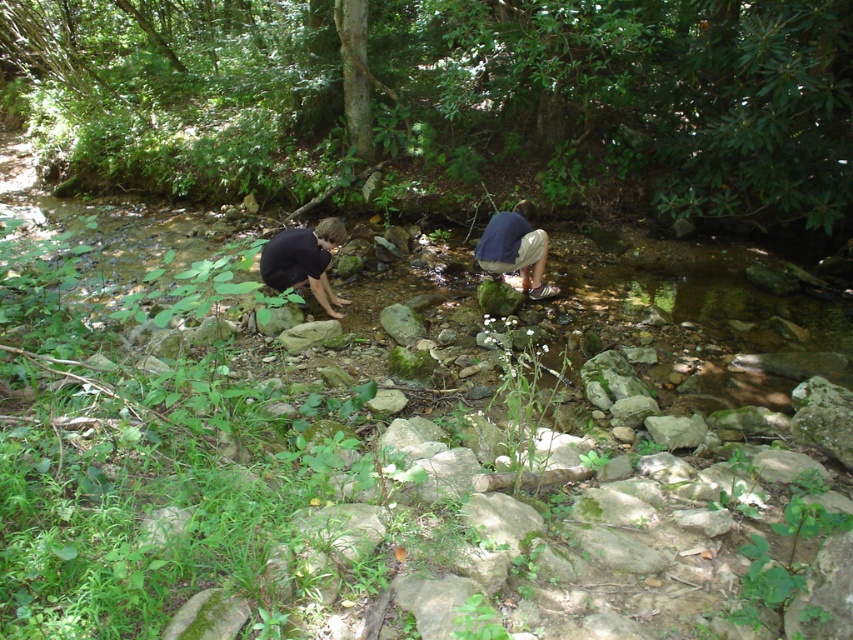
Between point (206, 84) and point (527, 237), which one is positioned behind?

The point (206, 84) is behind.

Can you confirm if green leafy forest at center is smaller than dark blue fabric at center?

No.

This screenshot has height=640, width=853. What are the coordinates of `green leafy forest at center` in the screenshot? It's located at (448, 100).

Where is `green leafy forest at center`? Image resolution: width=853 pixels, height=640 pixels. green leafy forest at center is located at coordinates (448, 100).

Measure the distance between green leafy forest at center and camera.

A distance of 6.24 meters exists between green leafy forest at center and camera.

Is point (142, 100) positioned before point (340, 300)?

No, it is not.

You are a GUI agent. You are given a task and a screenshot of the screen. Output one action in this format:
    pyautogui.click(x=<x>, y=<y>)
    Task: Click on the green leafy forest at center
    
    Given the screenshot: What is the action you would take?
    pyautogui.click(x=448, y=100)

Can you confirm if black matte shirt at center is smaller than dark blue fabric at center?

Yes, black matte shirt at center is smaller than dark blue fabric at center.

Is point (282, 289) closer to camera compared to point (476, 259)?

Yes, it is in front of point (476, 259).

Which is in front, point (335, 237) or point (521, 209)?

Positioned in front is point (335, 237).

Image resolution: width=853 pixels, height=640 pixels. I want to click on black matte shirt at center, so click(305, 260).